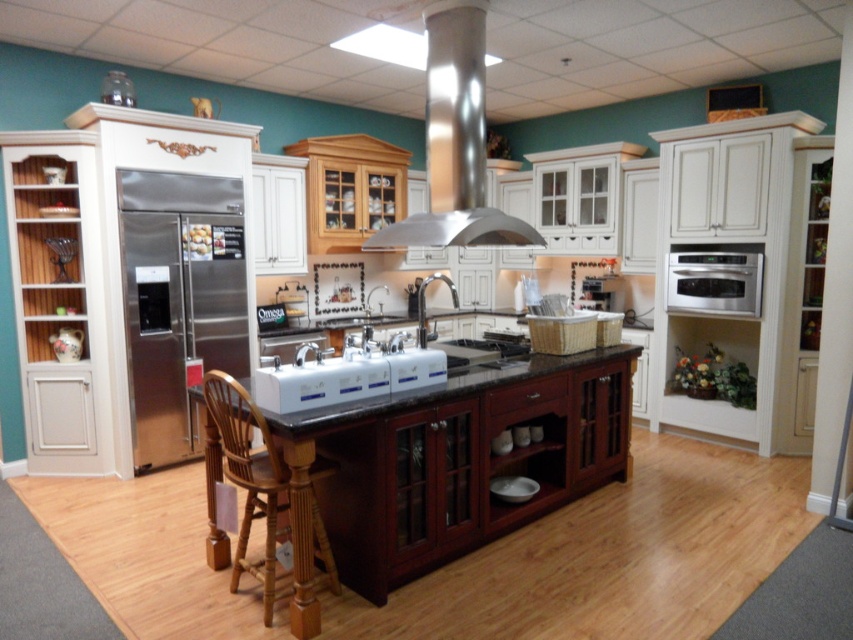
Question: Considering the relative positions of dark brown granite at center and stainless steel refrigerator at left in the image provided, where is dark brown granite at center located with respect to stainless steel refrigerator at left?

Choices:
 (A) left
 (B) right

Answer: (B)

Question: In this image, where is wooden chair at center located relative to stainless steel oven at right?

Choices:
 (A) below
 (B) above

Answer: (A)

Question: Which point is farther to the camera?

Choices:
 (A) dark brown granite at center
 (B) wooden chair at center
 (C) stainless steel exhaust hood at center

Answer: (C)

Question: Which point is farther to the camera?

Choices:
 (A) (286, 500)
 (B) (621, 451)
 (C) (427, 83)

Answer: (B)

Question: Does dark brown granite at center have a lesser width compared to black granite countertop at center?

Choices:
 (A) no
 (B) yes

Answer: (B)

Question: Which of the following is the farthest from the observer?

Choices:
 (A) (409, 532)
 (B) (384, 378)

Answer: (A)